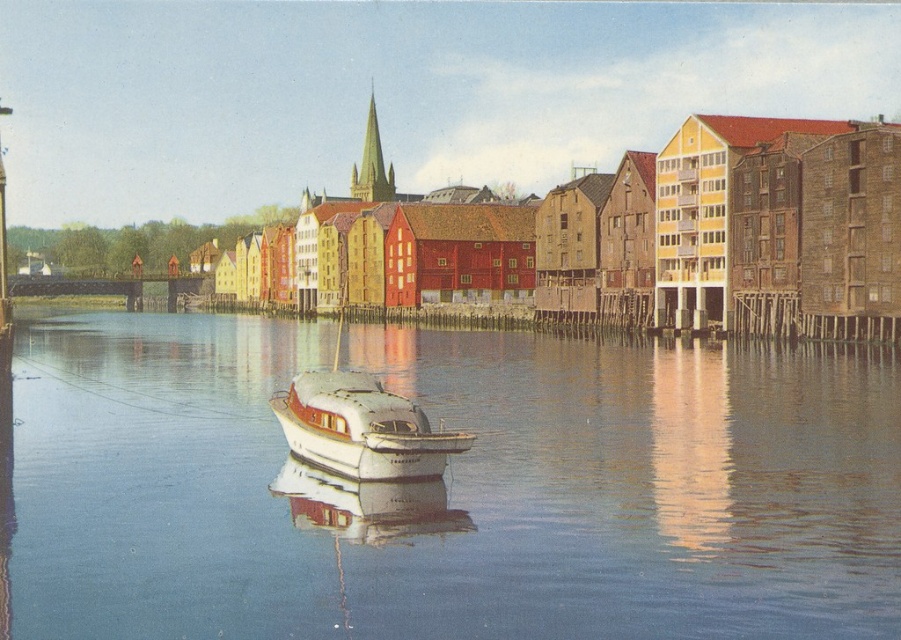
Is point (652, 470) positioned before point (353, 400)?

That is False.

I want to click on blue smooth water at center, so click(450, 488).

Does blue smooth water at center have a smaller size compared to green stone spire at upper center?

Yes.

Is blue smooth water at center taller than green stone spire at upper center?

No, blue smooth water at center is not taller than green stone spire at upper center.

Is point (71, 547) positioned in front of point (371, 182)?

Yes.

You are a GUI agent. You are given a task and a screenshot of the screen. Output one action in this format:
    pyautogui.click(x=<x>, y=<y>)
    Task: Click on the blue smooth water at center
    
    Given the screenshot: What is the action you would take?
    pyautogui.click(x=450, y=488)

Is white glossy boat at center smaller than green stone spire at upper center?

Yes, white glossy boat at center is smaller than green stone spire at upper center.

Does point (335, 417) come closer to viewer compared to point (363, 176)?

Yes, point (335, 417) is closer to viewer.

Find the location of `white glossy boat at center`. white glossy boat at center is located at coordinates (361, 428).